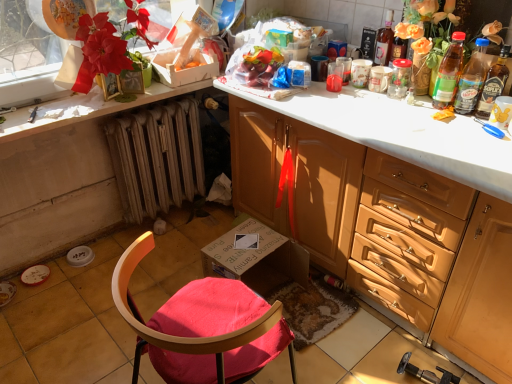
Where is `vacant area on top of white glossy countertop at upper left (from a real-world perspective)`? Image resolution: width=512 pixels, height=384 pixels. vacant area on top of white glossy countertop at upper left (from a real-world perspective) is located at coordinates (103, 97).